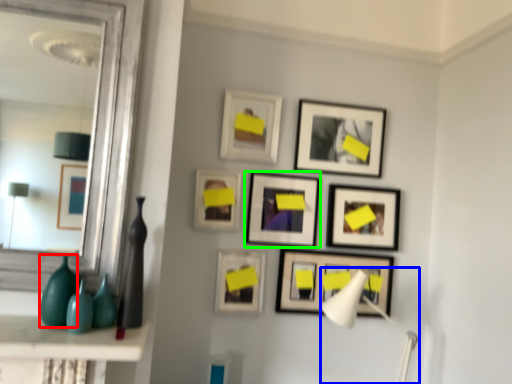
Question: Which object is the closest to the glass vase (highlighted by a red box)? Choose among these: table lamp (highlighted by a blue box) or picture frame (highlighted by a green box).

Choices:
 (A) table lamp
 (B) picture frame

Answer: (B)